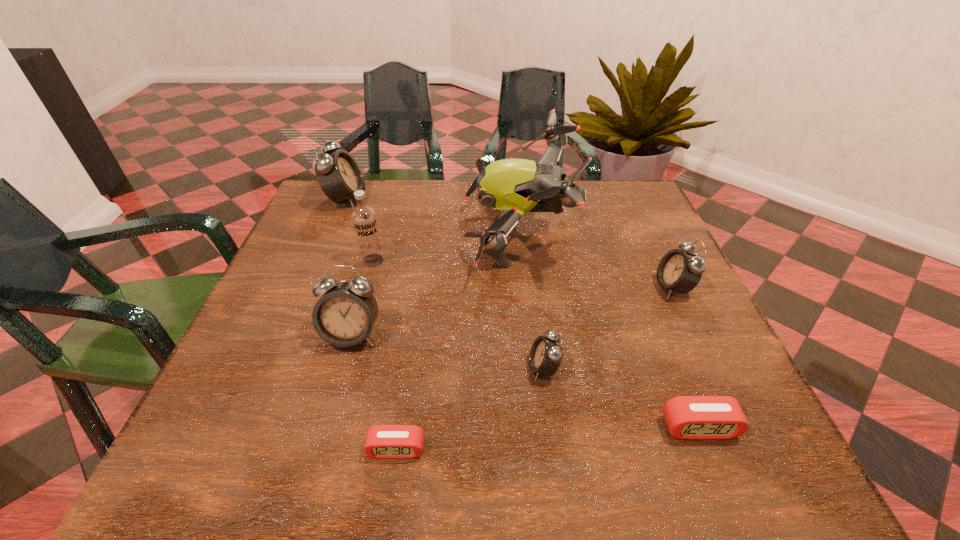
Where is `free space located on the face of the second tallest alarm clock`? This screenshot has width=960, height=540. free space located on the face of the second tallest alarm clock is located at coordinates (315, 469).

You are a GUI agent. You are given a task and a screenshot of the screen. Output one action in this format:
    pyautogui.click(x=<x>, y=<y>)
    Task: Click on the vacant space located 0.200m on the face of the third biggest white alarm clock
    This screenshot has height=540, width=960.
    Given the screenshot: What is the action you would take?
    pyautogui.click(x=564, y=288)

I want to click on free location located 0.320m on the face of the third biggest white alarm clock, so click(511, 288).

Locate an element on the screen. vacant space located on the face of the third biggest white alarm clock is located at coordinates (556, 288).

You are a GUI agent. You are given a task and a screenshot of the screen. Output one action in this format:
    pyautogui.click(x=<x>, y=<y>)
    Task: Click on the vacant area located 0.140m on the face of the third shortest alarm clock
    This screenshot has height=540, width=960.
    Given the screenshot: What is the action you would take?
    pyautogui.click(x=452, y=368)

Locate an element on the screen. Image resolution: width=960 pixels, height=540 pixels. vacant space located 0.390m on the face of the third shortest alarm clock is located at coordinates 316,368.

I want to click on blank space located 0.250m on the face of the third shortest alarm clock, so click(x=393, y=368).

This screenshot has width=960, height=540. I want to click on vacant space located on the front-facing side of the fifth tallest alarm clock, so click(x=716, y=471).

Identify the location of drone present at the far edge. (514, 187).

The width and height of the screenshot is (960, 540). I want to click on alarm clock that is at the far edge, so click(x=338, y=174).